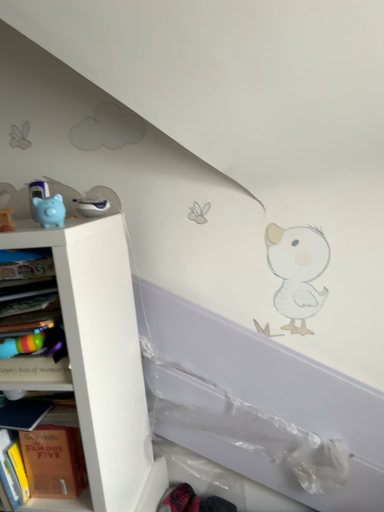
Question: Does multicolored plastic bookshelf at left appear on the right side of hardcover book at left, the first shelf viewed from the top?

Choices:
 (A) no
 (B) yes

Answer: (A)

Question: Considering the relative sizes of multicolored plastic bookshelf at left and hardcover book at left, the second shelf from the bottom, in the image provided, is multicolored plastic bookshelf at left thinner than hardcover book at left, the second shelf from the bottom,?

Choices:
 (A) yes
 (B) no

Answer: (B)

Question: Is multicolored plastic bookshelf at left outside hardcover book at left, the second shelf from the bottom?

Choices:
 (A) yes
 (B) no

Answer: (A)

Question: Does multicolored plastic bookshelf at left have a greater height compared to hardcover book at left, the second shelf from the bottom?

Choices:
 (A) yes
 (B) no

Answer: (A)

Question: Does multicolored plastic bookshelf at left have a smaller size compared to hardcover book at left, the second shelf from the bottom?

Choices:
 (A) yes
 (B) no

Answer: (B)

Question: Can you confirm if multicolored plastic bookshelf at left is wider than hardcover book at left, the second shelf from the bottom?

Choices:
 (A) yes
 (B) no

Answer: (A)

Question: Can you confirm if white matte shelf at left, which appears as the second shelf when viewed from the top, is positioned to the left of multicolored plastic bookshelf at left?

Choices:
 (A) yes
 (B) no

Answer: (A)

Question: Is white matte shelf at left, which appears as the second shelf when viewed from the top, smaller than multicolored plastic bookshelf at left?

Choices:
 (A) yes
 (B) no

Answer: (B)

Question: Is white matte shelf at left, which is the 1th shelf in bottom-to-top order, positioned beyond the bounds of multicolored plastic bookshelf at left?

Choices:
 (A) yes
 (B) no

Answer: (A)

Question: Is white matte shelf at left, which is the 1th shelf in bottom-to-top order, thinner than multicolored plastic bookshelf at left?

Choices:
 (A) no
 (B) yes

Answer: (A)

Question: From the image's perspective, is white matte shelf at left, which appears as the second shelf when viewed from the top, located beneath multicolored plastic bookshelf at left?

Choices:
 (A) yes
 (B) no

Answer: (A)

Question: Does white matte shelf at left, which appears as the second shelf when viewed from the top, come behind multicolored plastic bookshelf at left?

Choices:
 (A) yes
 (B) no

Answer: (A)

Question: From the image's perspective, is multicolored plastic bookshelf at left located above blue rubber piggy bank at left?

Choices:
 (A) no
 (B) yes

Answer: (A)